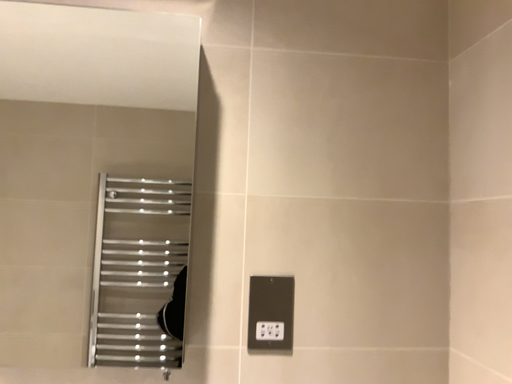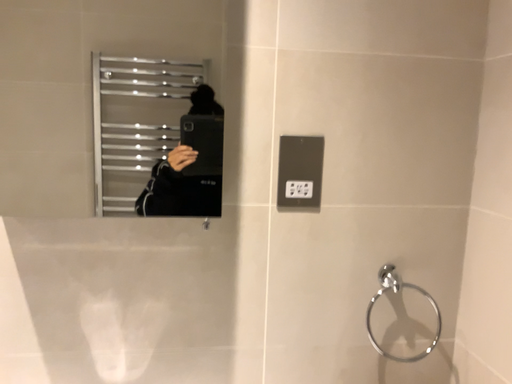
Question: Which way did the camera rotate in the video?

Choices:
 (A) rotated upward
 (B) rotated downward

Answer: (B)